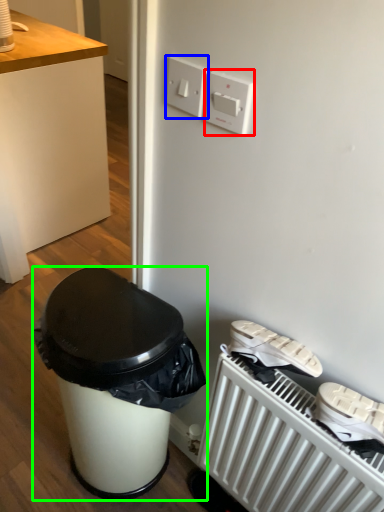
Question: Which object is positioned farthest from light switch (highlighted by a red box)? Select from electric outlet (highlighted by a blue box) and waste container (highlighted by a green box).

Choices:
 (A) electric outlet
 (B) waste container

Answer: (B)